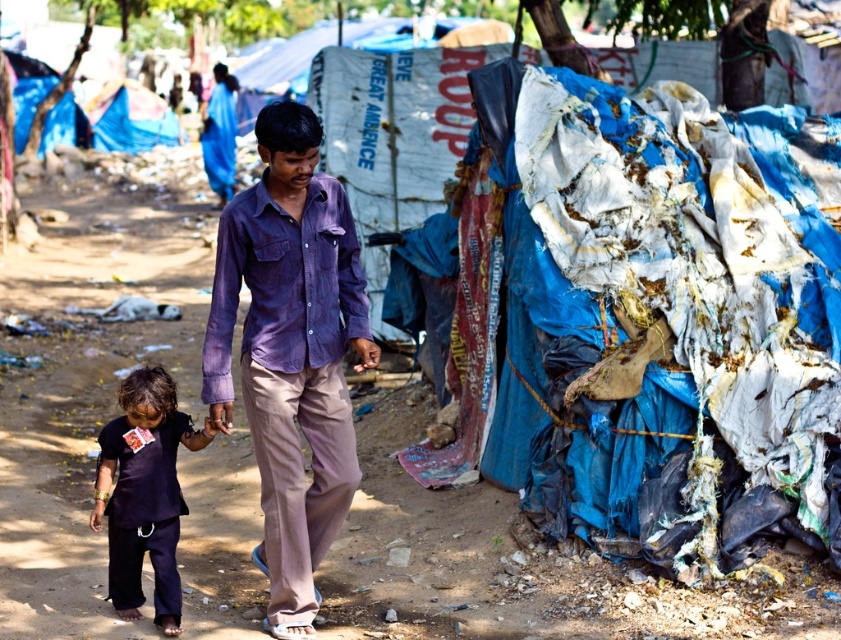
Does purple cotton shirt at center lie behind dark blue fabric at center?

No, purple cotton shirt at center is in front of dark blue fabric at center.

Based on the photo, does purple cotton shirt at center have a greater width compared to dark blue fabric at center?

Yes.

Is point (345, 310) behind point (168, 550)?

Yes, point (345, 310) is behind point (168, 550).

Find the location of a particular element. purple cotton shirt at center is located at coordinates (284, 284).

Based on the photo, between ragged plastic bags at right and dark blue fabric at center, which one is positioned lower?

dark blue fabric at center is lower down.

The image size is (841, 640). I want to click on ragged plastic bags at right, so click(x=654, y=314).

Identify the location of ragged plastic bags at right. (654, 314).

Is purple corduroy shirt at center to the left of purple cotton shirt at center from the viewer's perspective?

In fact, purple corduroy shirt at center is to the right of purple cotton shirt at center.

Who is more forward, (x=268, y=352) or (x=247, y=237)?

Point (x=247, y=237) is more forward.

Find the location of a particular element. purple corduroy shirt at center is located at coordinates [x=289, y=353].